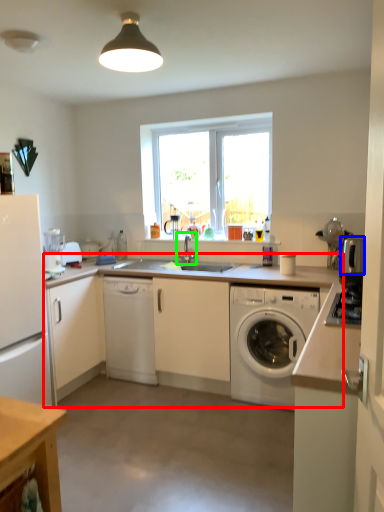
Question: Which object is the farthest from countertop (highlighted by a red box)? Choose among these: appliance (highlighted by a blue box) or tap (highlighted by a green box).

Choices:
 (A) appliance
 (B) tap

Answer: (A)